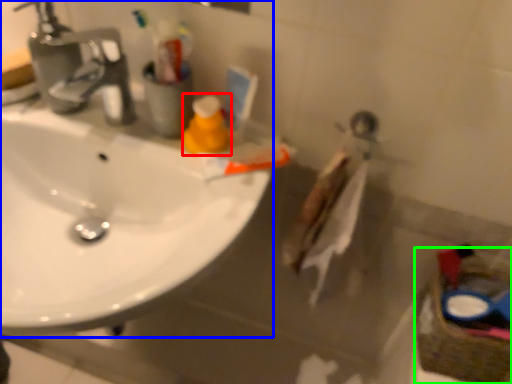
Question: Considering the real-world distances, which object is farthest from cleaning product (highlighted by a red box)? sink (highlighted by a blue box) or basket (highlighted by a green box)?

Choices:
 (A) sink
 (B) basket

Answer: (B)